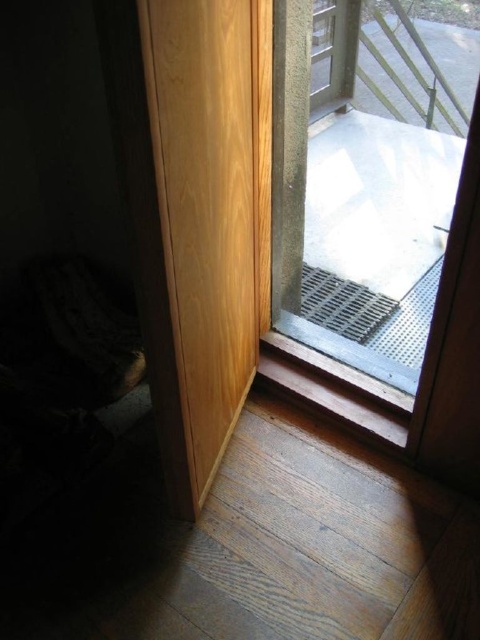
Question: Which point is closer to the camera taking this photo?

Choices:
 (A) (154, 104)
 (B) (328, 349)

Answer: (A)

Question: From the image, what is the correct spatial relationship of transparent glass door at upper right in relation to light wood door at left?

Choices:
 (A) right
 (B) left

Answer: (A)

Question: Can you confirm if transparent glass door at upper right is wider than light wood door at left?

Choices:
 (A) yes
 (B) no

Answer: (A)

Question: Is transparent glass door at upper right behind light wood door at left?

Choices:
 (A) no
 (B) yes

Answer: (B)

Question: Which object appears farthest from the camera in this image?

Choices:
 (A) transparent glass door at upper right
 (B) light wood door at left

Answer: (A)